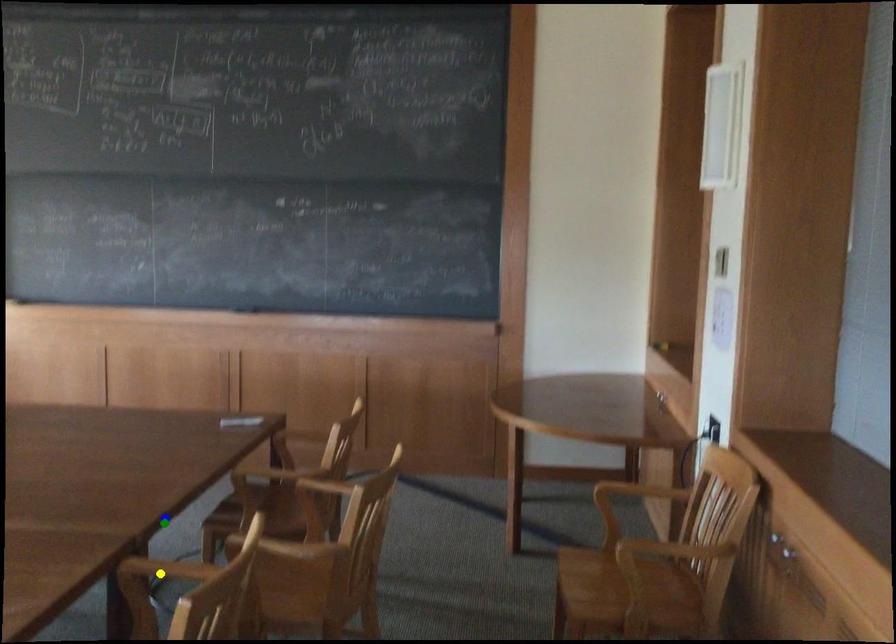
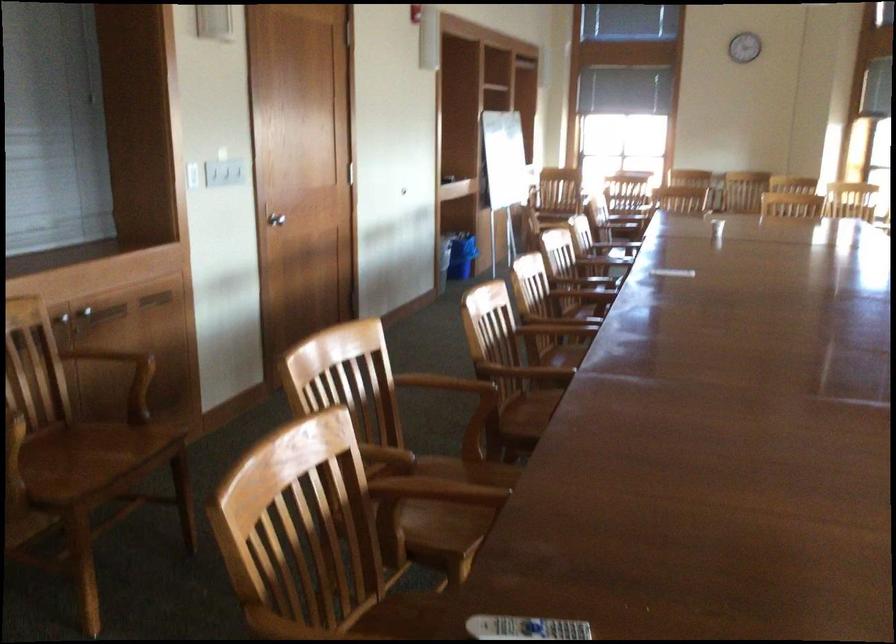
I am providing you with two images of the same scene from different viewpoints. Three points are marked in image1. Which point corresponds to a part or object that is occluded in image2?In image1, three points are marked. Which of them correspond to a part or object that is occluded in image2?Among the three points shown in image1, which one corresponds to a part or object that is no longer visible due to occlusion in image2?

yellow point cannot be seen in image2.